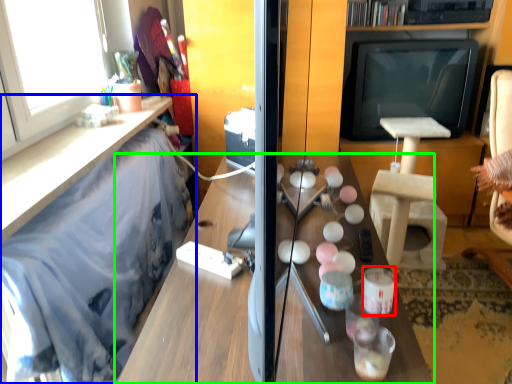
Question: Estimate the real-world distances between objects in this image. Which object is closer to candle holder (highlighted by a red box), furniture (highlighted by a blue box) or table (highlighted by a green box)?

Choices:
 (A) furniture
 (B) table

Answer: (B)